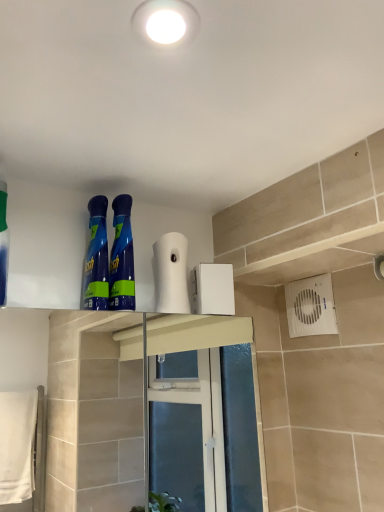
Question: Can you confirm if blue glossy bottle at upper left, arranged as the second cleaning product when viewed from the left, is bigger than blue glossy spray bottles at center, the third cleaning product positioned from the left?

Choices:
 (A) yes
 (B) no

Answer: (B)

Question: Can you confirm if blue glossy bottle at upper left, arranged as the second cleaning product when viewed from the left, is thinner than blue glossy spray bottles at center, the third cleaning product positioned from the left?

Choices:
 (A) no
 (B) yes

Answer: (A)

Question: Is blue glossy bottle at upper left, the second cleaning product positioned from the right, taller than blue glossy spray bottles at center, the third cleaning product positioned from the left?

Choices:
 (A) yes
 (B) no

Answer: (A)

Question: Is blue glossy bottle at upper left, the second cleaning product positioned from the right, beside blue glossy spray bottles at center, the third cleaning product positioned from the left?

Choices:
 (A) yes
 (B) no

Answer: (A)

Question: Does blue glossy bottle at upper left, the second cleaning product positioned from the right, appear on the right side of blue glossy spray bottles at center, the first cleaning product in the right-to-left sequence?

Choices:
 (A) yes
 (B) no

Answer: (B)

Question: Is blue glossy bottle at upper left, the second cleaning product positioned from the right, further to the viewer compared to blue glossy spray bottles at center, the first cleaning product in the right-to-left sequence?

Choices:
 (A) no
 (B) yes

Answer: (B)

Question: Does blue glossy spray bottles at center, the third cleaning product positioned from the left, come in front of green matte bottle at left, the first cleaning product viewed from the left?

Choices:
 (A) yes
 (B) no

Answer: (B)

Question: Is there a large distance between blue glossy spray bottles at center, the third cleaning product positioned from the left, and green matte bottle at left, the first cleaning product viewed from the left?

Choices:
 (A) no
 (B) yes

Answer: (A)

Question: Is blue glossy spray bottles at center, the third cleaning product positioned from the left, surrounding green matte bottle at left, acting as the third cleaning product starting from the right?

Choices:
 (A) yes
 (B) no

Answer: (B)

Question: Does blue glossy spray bottles at center, the third cleaning product positioned from the left, have a smaller size compared to green matte bottle at left, acting as the third cleaning product starting from the right?

Choices:
 (A) yes
 (B) no

Answer: (A)

Question: Does blue glossy spray bottles at center, the third cleaning product positioned from the left, have a greater height compared to green matte bottle at left, the first cleaning product viewed from the left?

Choices:
 (A) no
 (B) yes

Answer: (A)

Question: From a real-world perspective, does blue glossy spray bottles at center, the first cleaning product in the right-to-left sequence, stand above green matte bottle at left, the first cleaning product viewed from the left?

Choices:
 (A) no
 (B) yes

Answer: (A)

Question: Considering the relative sizes of white matte toilet paper at upper center and green matte bottle at left, acting as the third cleaning product starting from the right, in the image provided, is white matte toilet paper at upper center shorter than green matte bottle at left, acting as the third cleaning product starting from the right,?

Choices:
 (A) no
 (B) yes

Answer: (B)